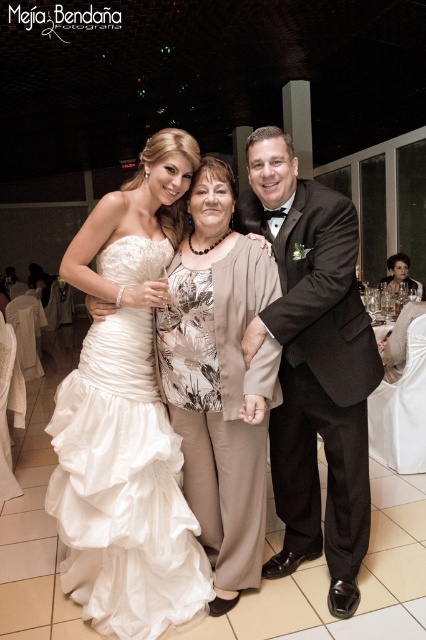
You are a photographer at the wedding reception. You need to adjust the lighting so that the white satin dress at left and the floral print blouse at center are both well illuminated. Considering their heights, which one requires the light to be placed lower to avoid shadows?

The white satin dress at left has a lesser height compared to floral print blouse at center, so the light should be placed lower for the white satin dress at left to avoid shadows.

You are a photographer at the wedding reception and want to capture a photo of the white satin dress at left and floral print blouse at center. The minimum distance required for your camera to focus on both subjects clearly is 9 inches. Can you take the photo without moving either subject?

The white satin dress at left and floral print blouse at center are 9.37 inches apart from each other. Since the required minimum distance is 9 inches, the camera can focus on both subjects clearly without moving them.

You are a photographer at the wedding reception. You need to capture a photo of the white satin dress at left and the black satin suit at center. Which one is closer to the camera?

The white satin dress at left is in front of the black satin suit at center, so it is closer to the camera.